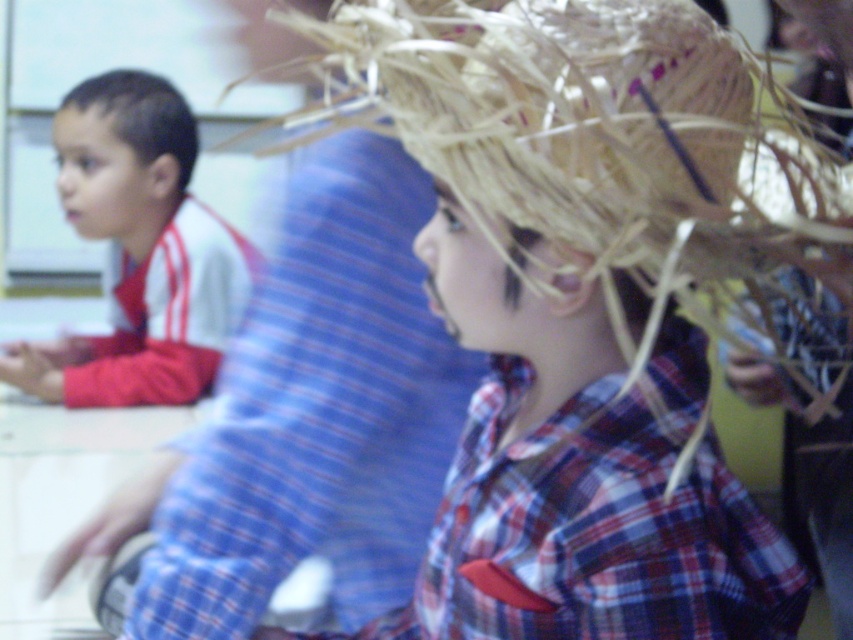
Where is the plaid fabric at center located in the image?

The plaid fabric at center is located at point (318, 412) in the image.

You are a photographer adjusting the camera focus. You notice the matte white shirt at left and the brown matte hair at left in your frame. Which object should you focus on first if you want to ensure the taller one is in sharp focus?

The matte white shirt at left has a greater height compared to brown matte hair at left, so you should focus on the matte white shirt at left first to ensure the taller one is in sharp focus.